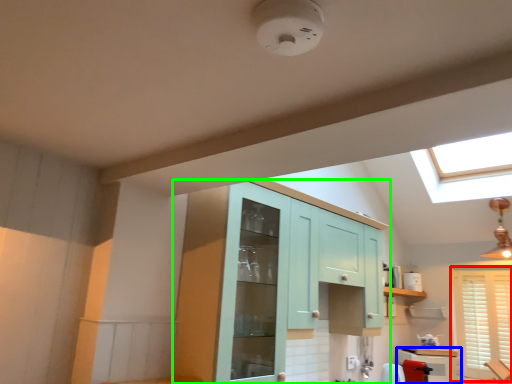
Question: Estimate the real-world distances between objects in this image. Which object is closer to window (highlighted by a red box), cabinetry (highlighted by a blue box) or cabinetry (highlighted by a green box)?

Choices:
 (A) cabinetry
 (B) cabinetry

Answer: (A)